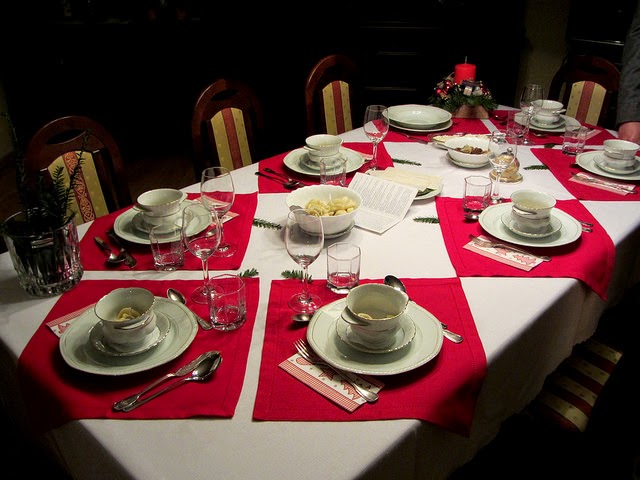
The height and width of the screenshot is (480, 640). I want to click on wine glasses, so click(301, 255), click(210, 245), click(226, 184), click(376, 130), click(530, 103), click(495, 168).